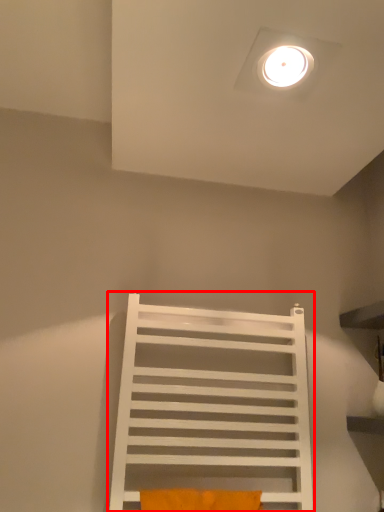
Question: From the image's perspective, where is furniture (annotated by the red box) located relative to pillow?

Choices:
 (A) below
 (B) above

Answer: (B)